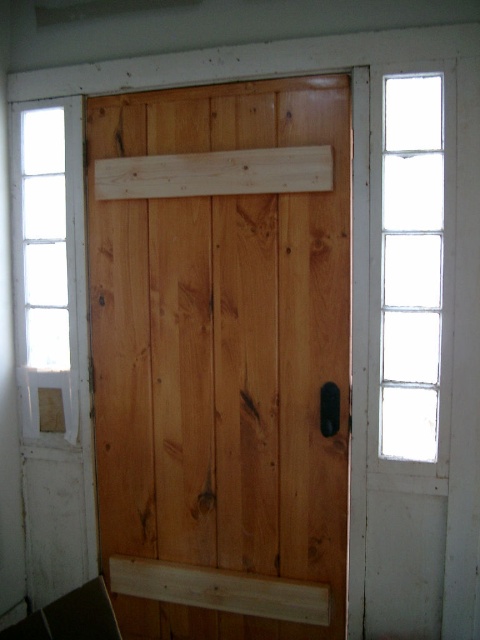
You are standing in a room with a wooden door. There is a point at coordinates (x=223, y=356). What object does this point correspond to?

The point at coordinates (x=223, y=356) corresponds to the natural wood barn door at center.

You are a painter trying to paint the wooden door. You have two points to paint, point (230, 113) and point (396, 108). Which point should you paint first if you want to paint the closest point to you first?

Point (230, 113) is further to the viewer than point (396, 108), so you should paint point (396, 108) first because it is closer to you.